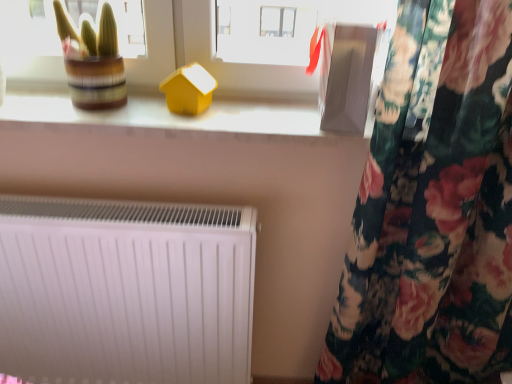
You are a GUI agent. You are given a task and a screenshot of the screen. Output one action in this format:
    pyautogui.click(x=<x>, y=<y>)
    Task: Click on the vacant space to the left of matte yellow house at center
    The image size is (512, 384).
    Given the screenshot: What is the action you would take?
    pyautogui.click(x=132, y=114)